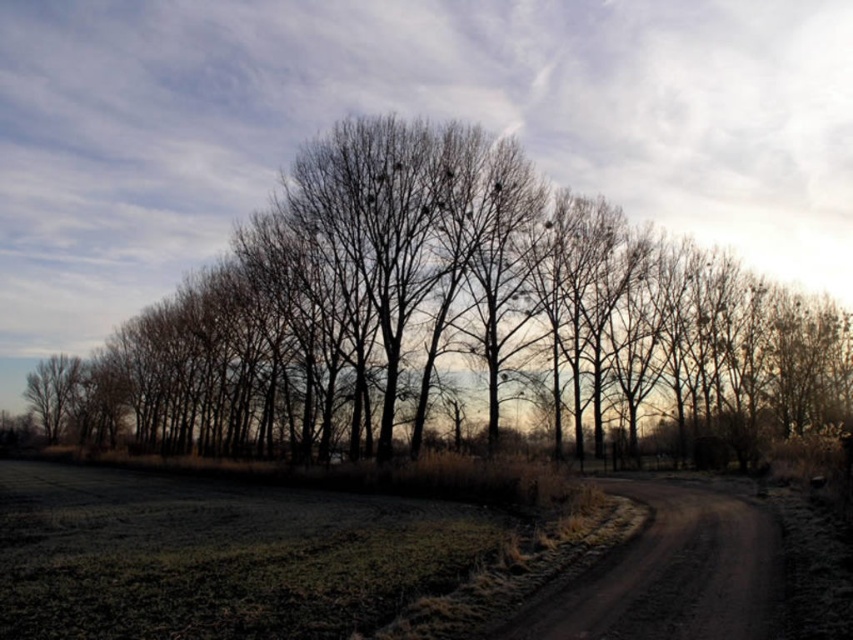
You are a hiker who wants to take a photo of the brown bark tree at center while standing on the dusty brown dirt track at lower right. Can you see the entire tree in your camera frame without moving your position?

The brown bark tree at center is located above the dusty brown dirt track at lower right, so yes, you can see the entire tree in your camera frame while standing on the track without needing to move.

You are standing in the middle of the dirt road and want to walk towards the brown bark tree at center. Is the dusty brown dirt track at lower right behind or in front of you?

The brown bark tree at center is further to the viewer than the dusty brown dirt track at lower right, so the dusty brown dirt track at lower right is behind you.